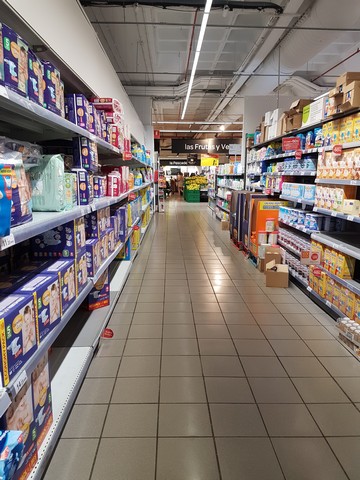
You are a GUI agent. You are given a task and a screenshot of the screen. Output one action in this format:
    pyautogui.click(x=<x>, y=<y>)
    Task: Click on the 1 opened box on floor
    The image size is (360, 480).
    Given the screenshot: What is the action you would take?
    pyautogui.click(x=280, y=275)